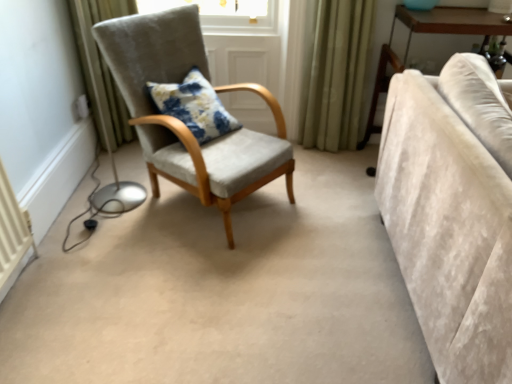
Question: Does beige velvet couch at right contain light brown wooden table at right?

Choices:
 (A) no
 (B) yes

Answer: (A)

Question: From a real-world perspective, is beige velvet couch at right on top of light brown wooden table at right?

Choices:
 (A) no
 (B) yes

Answer: (B)

Question: Does beige velvet couch at right have a greater height compared to light brown wooden table at right?

Choices:
 (A) yes
 (B) no

Answer: (B)

Question: From the image's perspective, is beige velvet couch at right under light brown wooden table at right?

Choices:
 (A) no
 (B) yes

Answer: (B)

Question: Can you confirm if beige velvet couch at right is positioned to the right of light brown wooden table at right?

Choices:
 (A) no
 (B) yes

Answer: (A)

Question: Does beige velvet couch at right lie behind light brown wooden table at right?

Choices:
 (A) yes
 (B) no

Answer: (B)

Question: Can you confirm if light brown wooden table at right is shorter than beige velvet couch at right?

Choices:
 (A) yes
 (B) no

Answer: (B)

Question: From the image's perspective, is light brown wooden table at right below beige velvet couch at right?

Choices:
 (A) no
 (B) yes

Answer: (A)

Question: Does light brown wooden table at right touch beige velvet couch at right?

Choices:
 (A) yes
 (B) no

Answer: (B)

Question: Can you confirm if light brown wooden table at right is taller than beige velvet couch at right?

Choices:
 (A) no
 (B) yes

Answer: (B)

Question: Is light brown wooden table at right aimed at beige velvet couch at right?

Choices:
 (A) yes
 (B) no

Answer: (A)

Question: Is light brown wooden table at right located outside beige velvet couch at right?

Choices:
 (A) no
 (B) yes

Answer: (B)

Question: From the image's perspective, does floral fabric cushion at center appear higher than light brown wooden table at right?

Choices:
 (A) yes
 (B) no

Answer: (B)